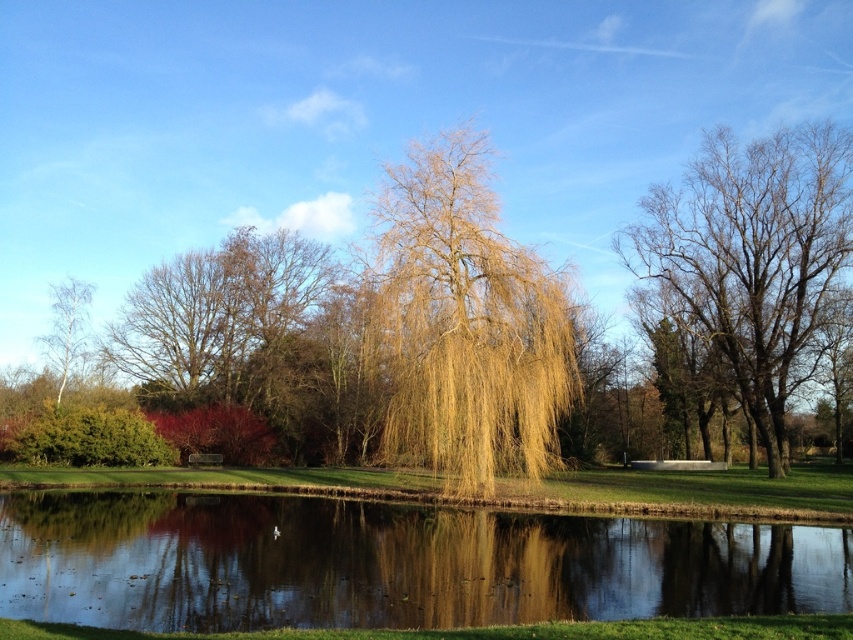
Question: Considering the relative positions of reflective glass water at center and white smooth birch at left in the image provided, where is reflective glass water at center located with respect to white smooth birch at left?

Choices:
 (A) left
 (B) right

Answer: (B)

Question: Where is bare wood tree at right located in relation to white smooth birch at left in the image?

Choices:
 (A) left
 (B) right

Answer: (B)

Question: Which point is farther to the camera?

Choices:
 (A) reflective glass water at center
 (B) green grassy golf course at center
 (C) golden-brown textured willow at center

Answer: (B)

Question: Estimate the real-world distances between objects in this image. Which object is farther from the bare wood tree at right?

Choices:
 (A) reflective glass water at center
 (B) white smooth birch at left

Answer: (B)

Question: From the image, what is the correct spatial relationship of green grassy golf course at center in relation to white smooth birch at left?

Choices:
 (A) left
 (B) right

Answer: (B)

Question: Which point is closer to the camera?

Choices:
 (A) (724, 342)
 (B) (457, 374)
 (C) (106, 474)

Answer: (B)